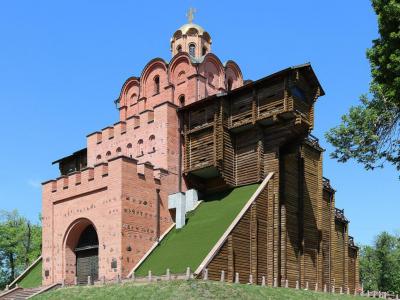
This screenshot has height=300, width=400. I want to click on staircase, so click(17, 290).